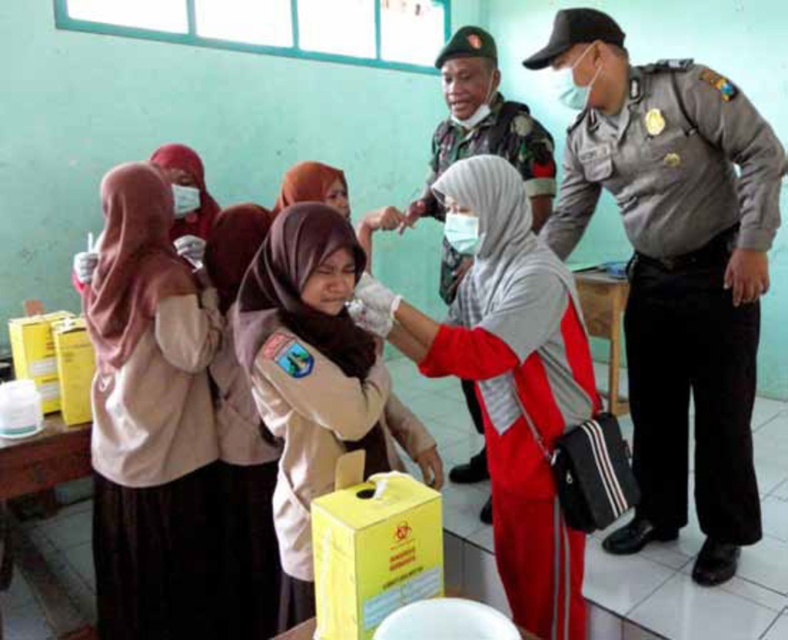
Locate an element on the screen. Image resolution: width=788 pixels, height=640 pixels. matte white uniform at center is located at coordinates (311, 378).

Is point (335, 280) more distant than point (428, 212)?

No, it is not.

Does point (258, 355) come closer to viewer compared to point (400, 230)?

That is True.

Locate an element on the screen. The image size is (788, 640). matte white uniform at center is located at coordinates (311, 378).

Who is more forward, (611, 170) or (515, 237)?

Point (515, 237)

Can you confirm if gray uniformed officer at right is wider than red fabric hijab at center?

Indeed, gray uniformed officer at right has a greater width compared to red fabric hijab at center.

Identify the location of gray uniformed officer at right. This screenshot has width=788, height=640. tap(675, 269).

Find the location of a particular element. Image resolution: width=788 pixels, height=640 pixels. gray uniformed officer at right is located at coordinates (675, 269).

Is red fabric hijab at center positioned at the back of matte khaki uniform at center?

No, red fabric hijab at center is closer to the viewer.

The width and height of the screenshot is (788, 640). Describe the element at coordinates (508, 380) in the screenshot. I see `red fabric hijab at center` at that location.

At what (x,y) coordinates should I click in order to perform the action: click on red fabric hijab at center. Please return your answer as a coordinate pair (x, y). This screenshot has width=788, height=640. Looking at the image, I should click on (508, 380).